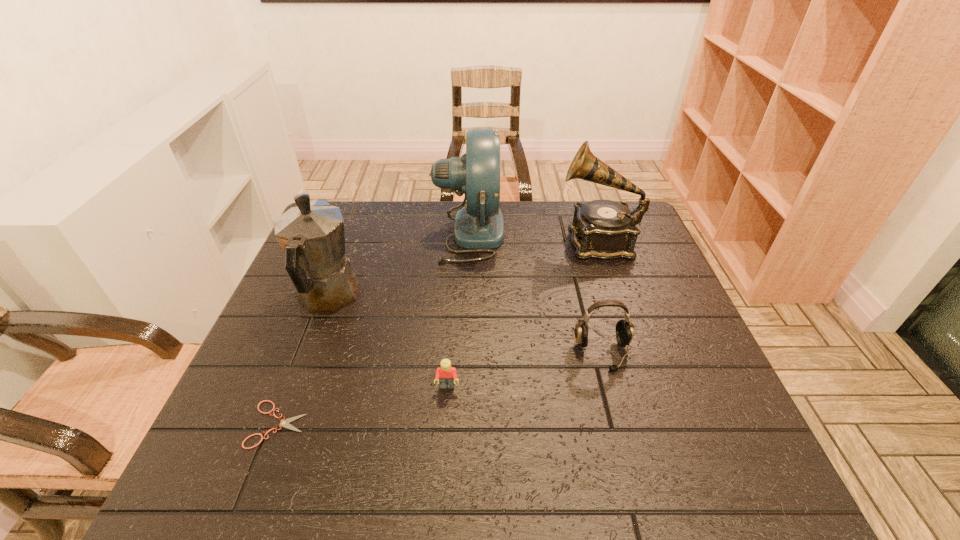
Locate an element on the screen. fan is located at coordinates (479, 226).

Locate an element on the screen. The image size is (960, 540). phonograph record is located at coordinates (604, 229).

At what (x,y) coordinates should I click in order to perform the action: click on coffeepot. Please return your answer as a coordinate pair (x, y). Looking at the image, I should click on (312, 235).

Identify the location of the fourth tallest object. (624, 329).

You are a GUI agent. You are given a task and a screenshot of the screen. Output one action in this format:
    pyautogui.click(x=<x>, y=<y>)
    Task: Click on the fifth farthest object
    The image size is (960, 540).
    Given the screenshot: What is the action you would take?
    pyautogui.click(x=447, y=374)

At what (x,y) coordinates should I click in order to perform the action: click on Lego. Please return your answer as a coordinate pair (x, y). Looking at the image, I should click on (447, 374).

Identify the location of shears. (284, 423).

Where is `the nearest object`? the nearest object is located at coordinates (284, 423).

Identify the location of free region located 0.170m in front of the fan to blow air. Image resolution: width=960 pixels, height=540 pixels. (559, 233).

You are a GUI agent. You are given a task and a screenshot of the screen. Output one action in this format:
    pyautogui.click(x=<x>, y=<y>)
    Task: Click on the free spot located 0.240m on the horn of the phonograph record
    
    Given the screenshot: What is the action you would take?
    [x=480, y=241]